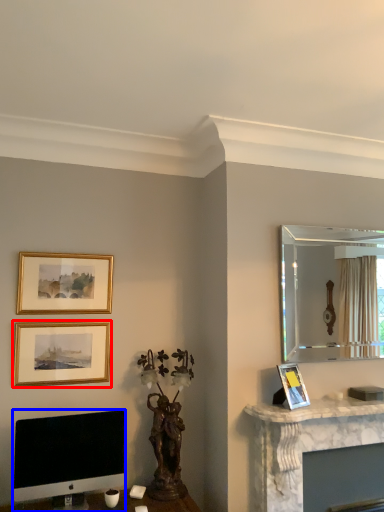
Question: Among these objects, which one is farthest to the camera, picture frame (highlighted by a red box) or computer monitor (highlighted by a blue box)?

Choices:
 (A) picture frame
 (B) computer monitor

Answer: (A)